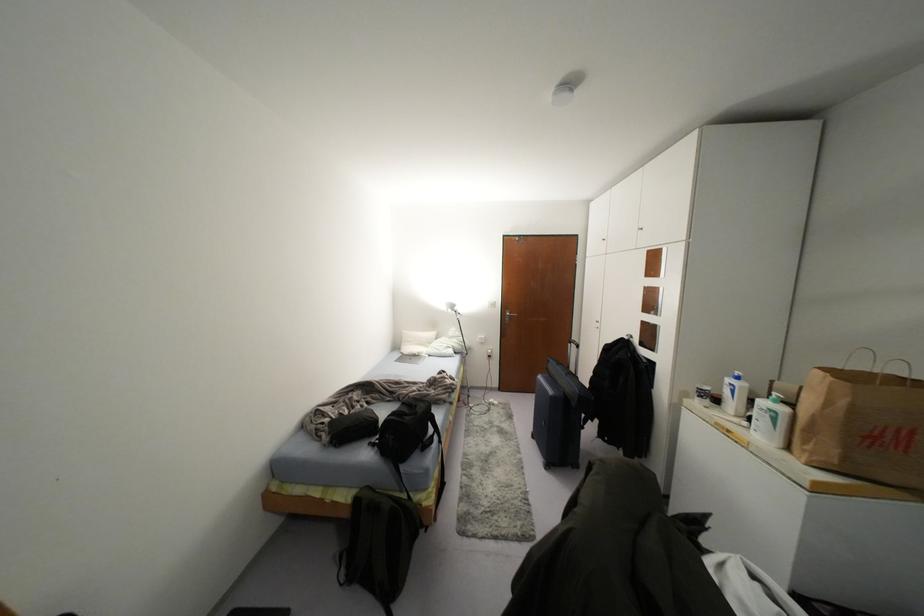
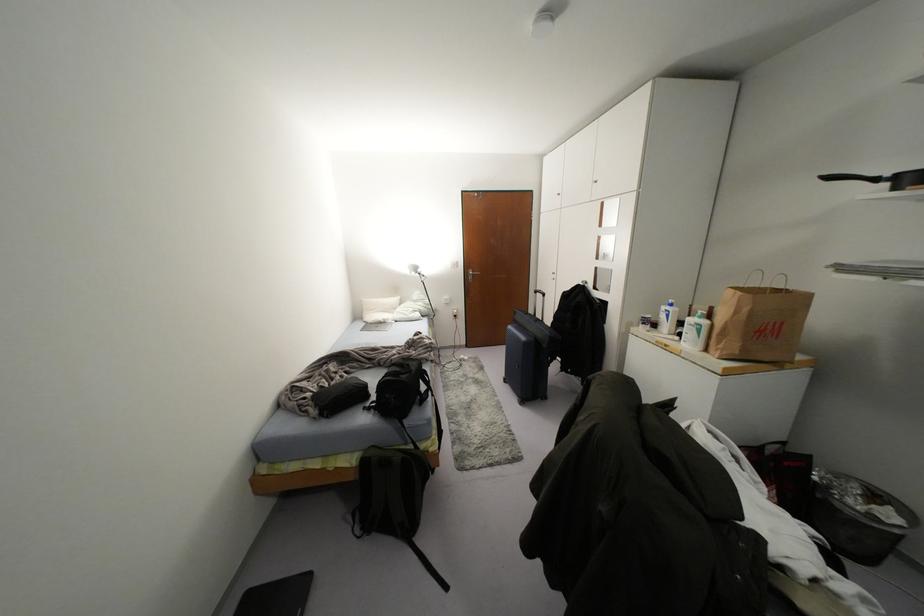
The point at (577, 346) is marked in the first image. Where is the corresponding point in the second image?

(542, 294)